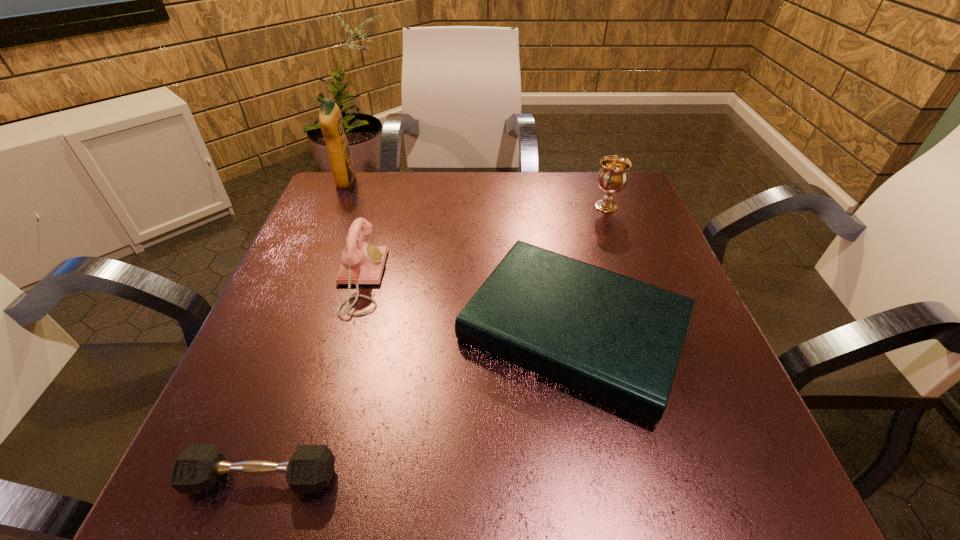
Find the location of a particular element. The image size is (960, 540). object positioned at the near left corner is located at coordinates (198, 468).

Find the location of a particular element. object located in the far right corner section of the desktop is located at coordinates (613, 175).

You are a GUI agent. You are given a task and a screenshot of the screen. Output one action in this format:
    pyautogui.click(x=<x>, y=<y>)
    Task: Click on the vacant region at the far edge of the desktop
    
    Given the screenshot: What is the action you would take?
    pyautogui.click(x=390, y=206)

In the image, there is a desktop. What are the coordinates of `vacant space at the left edge` in the screenshot? It's located at (273, 319).

Find the location of a particular element. Image resolution: width=960 pixels, height=540 pixels. free space at the right edge is located at coordinates (654, 247).

In the image, there is a desktop. Identify the location of vacant space at the far left corner. (375, 221).

In the image, there is a desktop. Where is `vacant space at the far right corner`? vacant space at the far right corner is located at coordinates (633, 183).

In the image, there is a desktop. At what (x,y) coordinates should I click in order to perform the action: click on vacant space at the near right corner. Please return your answer as a coordinate pair (x, y). The height and width of the screenshot is (540, 960). Looking at the image, I should click on (660, 481).

You are a GUI agent. You are given a task and a screenshot of the screen. Output one action in this format:
    pyautogui.click(x=<x>, y=<y>)
    Task: Click on the free space that is in between the chalice and the telephone
    
    Given the screenshot: What is the action you would take?
    pyautogui.click(x=483, y=243)

I want to click on vacant space in between the book and the nearest object, so click(418, 404).